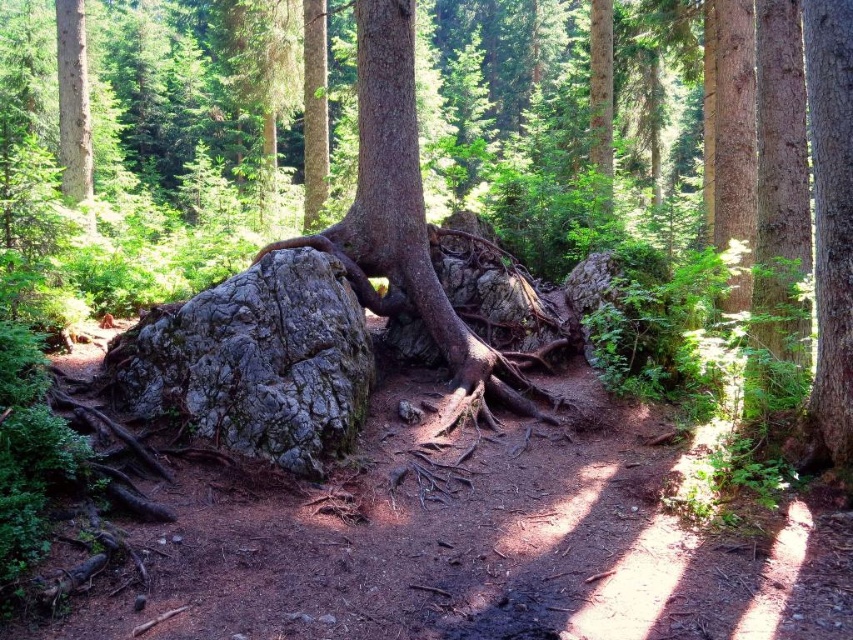
Who is positioned more to the left, gray rough rock at center or gray rough boulder at center?

Positioned to the left is gray rough boulder at center.

Is gray rough rock at center positioned before gray rough boulder at center?

No, it is behind gray rough boulder at center.

At what (x,y) coordinates should I click in order to perform the action: click on gray rough rock at center. Please return your answer as a coordinate pair (x, y). The image size is (853, 640). Looking at the image, I should click on (320, 301).